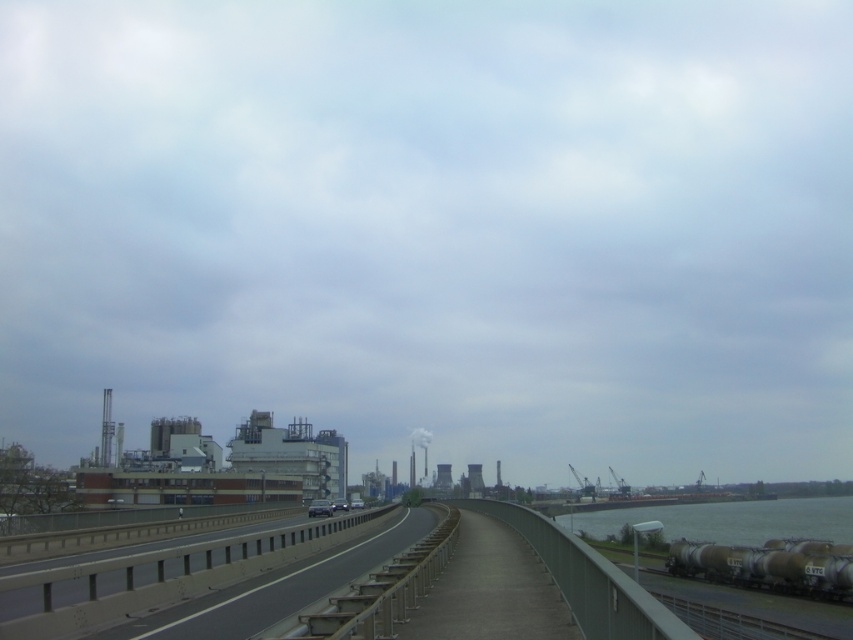
You are a photographer standing on the pedestrian walkway of the bridge. You want to capture a photo that includes both the gray metallic water at lower right and the silver metallic train carriages at lower right. Which object should you position closer to the edge of your camera frame to ensure both are fully visible?

Since the gray metallic water at lower right is bigger than the silver metallic train carriages at lower right, you should position the gray metallic water at lower right closer to the edge of your camera frame to ensure both are fully visible.

You are standing on the pedestrian walkway of the bridge and want to reach a point marked at coordinates point (759, 545). There is another point marked at point (793, 552) in your path. Which point is closer to your current position?

Point (793, 552) is closer to your current position because it is in front of point (759, 545), which is behind it.